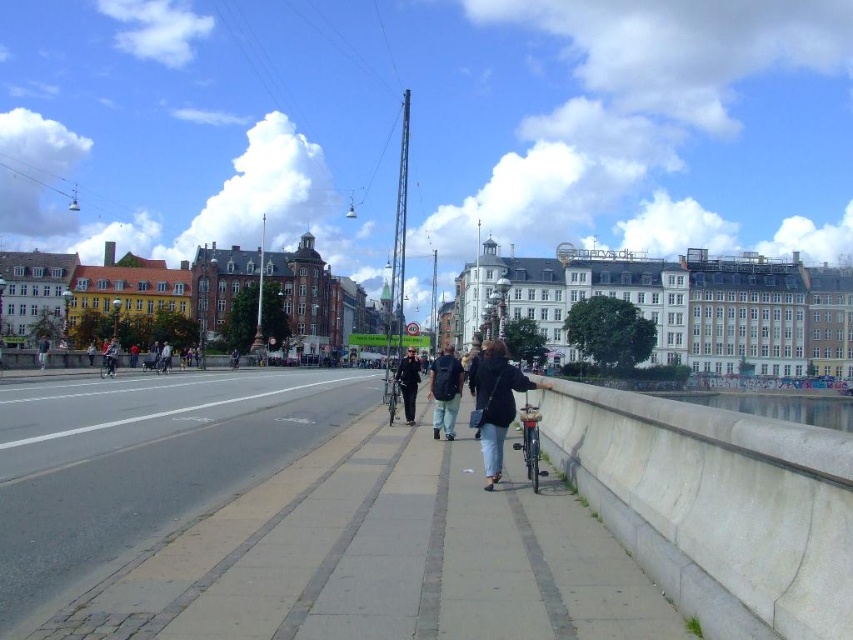
Question: Can you confirm if dark blue backpack at center is bigger than dark blue uniform at center?

Choices:
 (A) no
 (B) yes

Answer: (B)

Question: Which of these objects is positioned farthest from the denim jacket at center?

Choices:
 (A) gray concrete waterway at lower right
 (B) dark blue uniform at center
 (C) gray concrete pavement at center
 (D) dark blue backpack at center

Answer: (A)

Question: Does denim jacket at center have a smaller size compared to gray concrete waterway at lower right?

Choices:
 (A) yes
 (B) no

Answer: (A)

Question: Which of the following is the closest to the observer?

Choices:
 (A) gray concrete pavement at center
 (B) denim jacket at center

Answer: (A)

Question: Which point appears closest to the camera in this image?

Choices:
 (A) (418, 365)
 (B) (833, 417)

Answer: (A)

Question: Does dark blue backpack at center have a greater width compared to dark blue uniform at center?

Choices:
 (A) yes
 (B) no

Answer: (A)